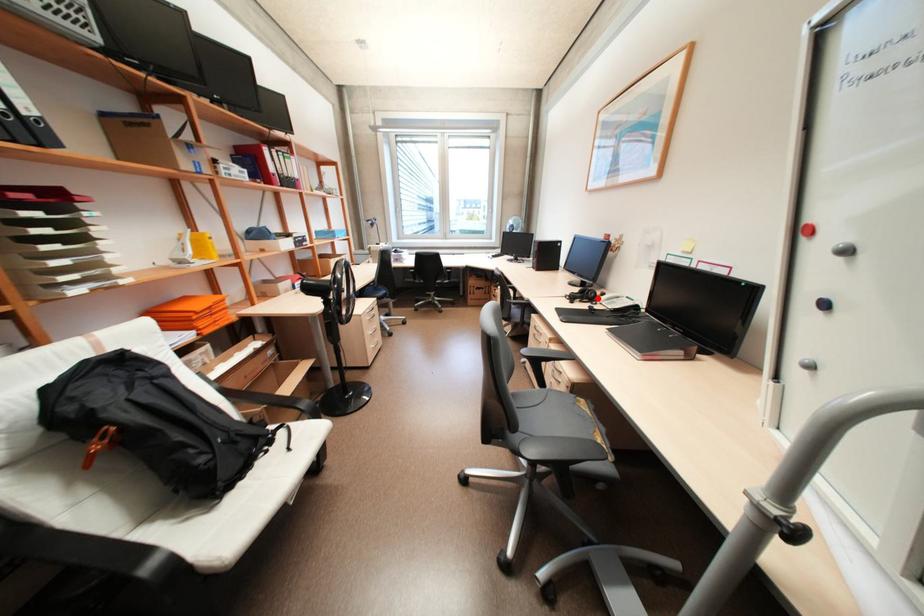
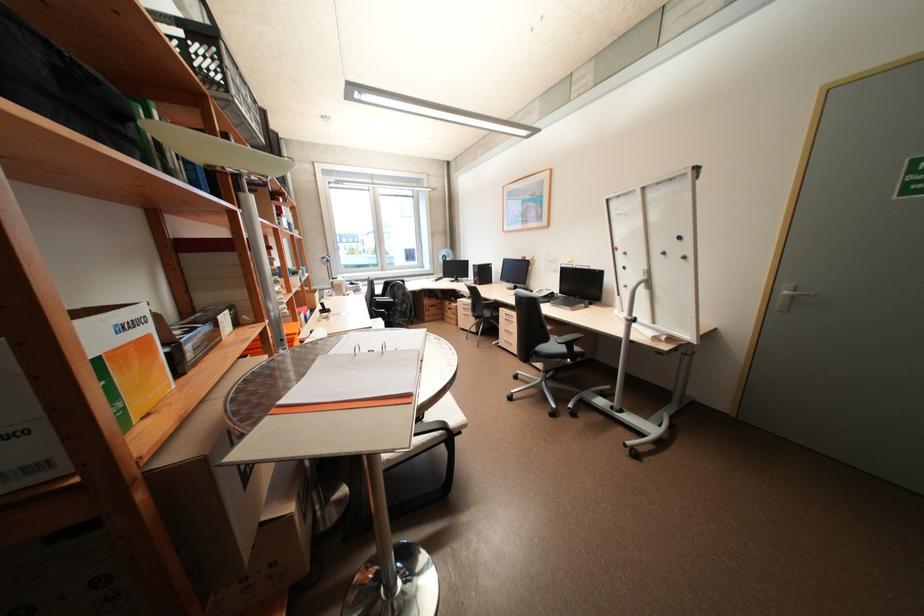
Question: I am providing you with two images of the same scene from different viewpoints. A red point is marked on the first image. Is the red point's position out of view in image 2?

Choices:
 (A) Yes
 (B) No

Answer: (A)